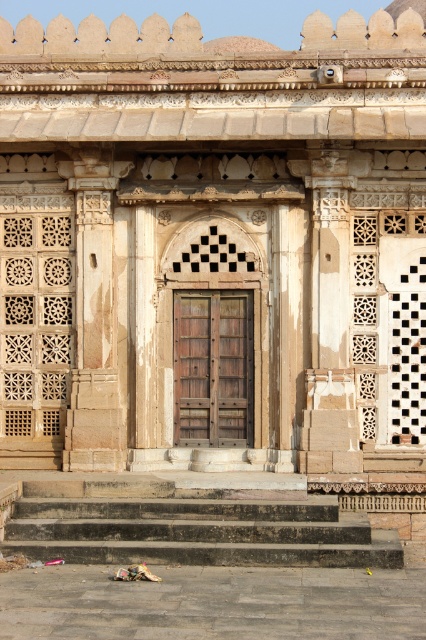
Question: Does dark gray stone stairs at lower center have a greater width compared to wooden textured door at center?

Choices:
 (A) yes
 (B) no

Answer: (A)

Question: Which of the following is the closest to the observer?

Choices:
 (A) wooden textured door at center
 (B) dark gray stone stairs at lower center

Answer: (B)

Question: In this image, where is dark gray stone stairs at lower center located relative to wooden textured door at center?

Choices:
 (A) below
 (B) above

Answer: (A)

Question: Does dark gray stone stairs at lower center have a larger size compared to wooden textured door at center?

Choices:
 (A) yes
 (B) no

Answer: (A)

Question: Which point is farther to the camera?

Choices:
 (A) (55, 483)
 (B) (235, 337)

Answer: (B)

Question: Among these objects, which one is nearest to the camera?

Choices:
 (A) wooden textured door at center
 (B) dark gray stone stairs at lower center

Answer: (B)